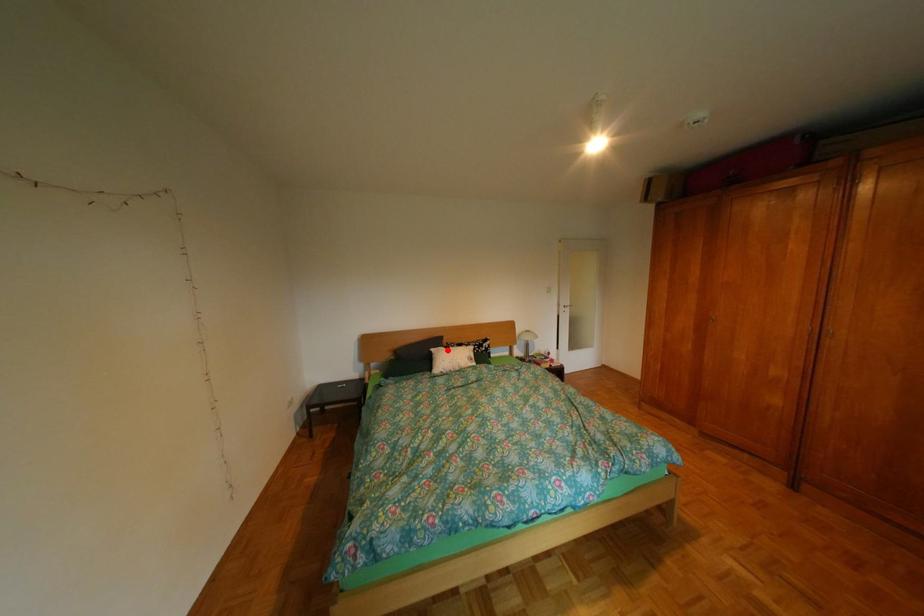
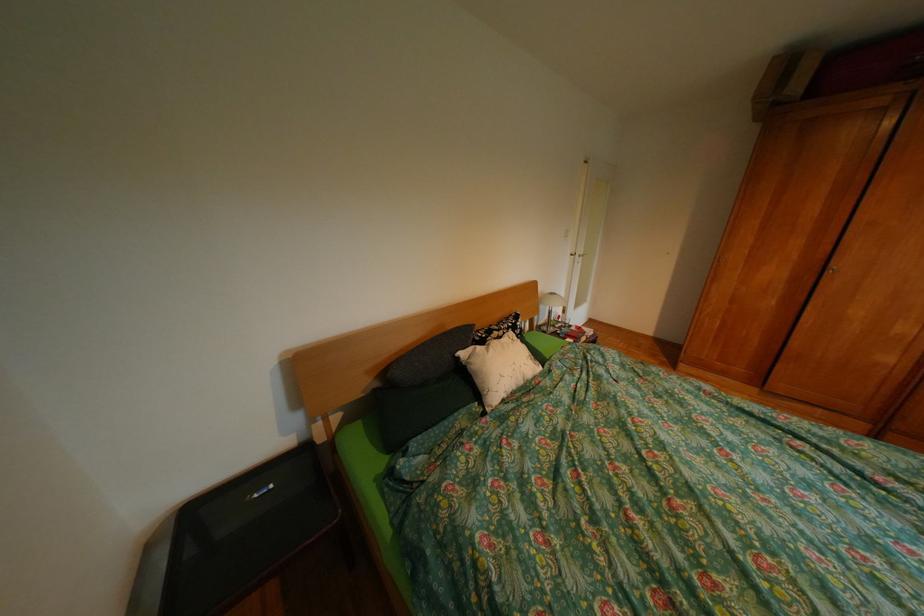
Locate, in the second image, the point that corresponds to the highlighted location in the first image.

(477, 354)